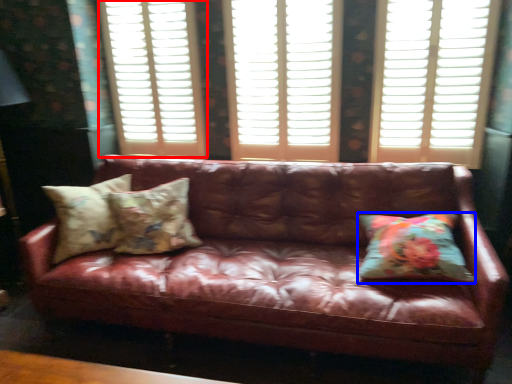
Question: Which of the following is the closest to the observer, window frame (highlighted by a red box) or pillow (highlighted by a blue box)?

Choices:
 (A) window frame
 (B) pillow

Answer: (B)